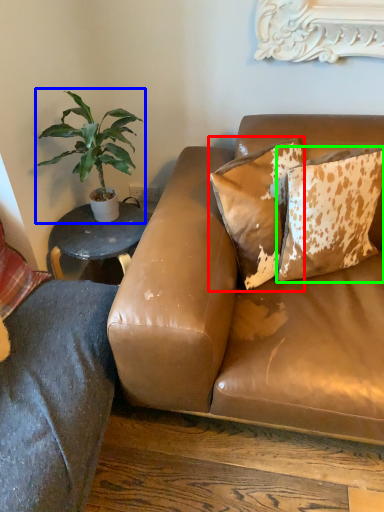
Question: Based on their relative distances, which object is nearer to pillow (highlighted by a red box)? Choose from houseplant (highlighted by a blue box) and pillow (highlighted by a green box).

Choices:
 (A) houseplant
 (B) pillow

Answer: (B)